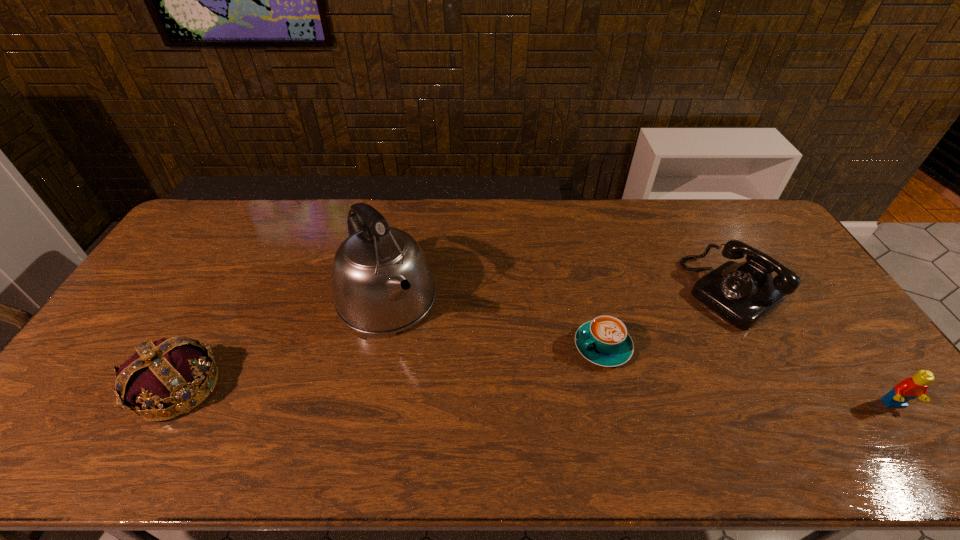
What are the coordinates of `Lego at the right edge` in the screenshot? It's located at (910, 388).

At what (x,y) coordinates should I click in order to perform the action: click on telephone present at the right edge. Please return your answer as a coordinate pair (x, y). This screenshot has width=960, height=540. Looking at the image, I should click on (744, 293).

Locate an element on the screen. The image size is (960, 540). object at the near right corner is located at coordinates (910, 388).

Find the location of a particular element. The image size is (960, 540). vacant space at the far edge is located at coordinates (258, 199).

Image resolution: width=960 pixels, height=540 pixels. In the image, there is a desktop. Find the location of `free region at the near edge`. free region at the near edge is located at coordinates (819, 404).

This screenshot has height=540, width=960. I want to click on free region at the left edge, so click(x=187, y=292).

This screenshot has width=960, height=540. What are the coordinates of `vacant area at the right edge` in the screenshot? It's located at (829, 346).

I want to click on vacant region at the far left corner of the desktop, so [x=230, y=224].

Locate an element on the screen. This screenshot has width=960, height=540. vacant area at the near right corner of the desktop is located at coordinates (843, 395).

Where is `empty space that is in between the cappuccino and the Lego`? This screenshot has height=540, width=960. empty space that is in between the cappuccino and the Lego is located at coordinates (749, 376).